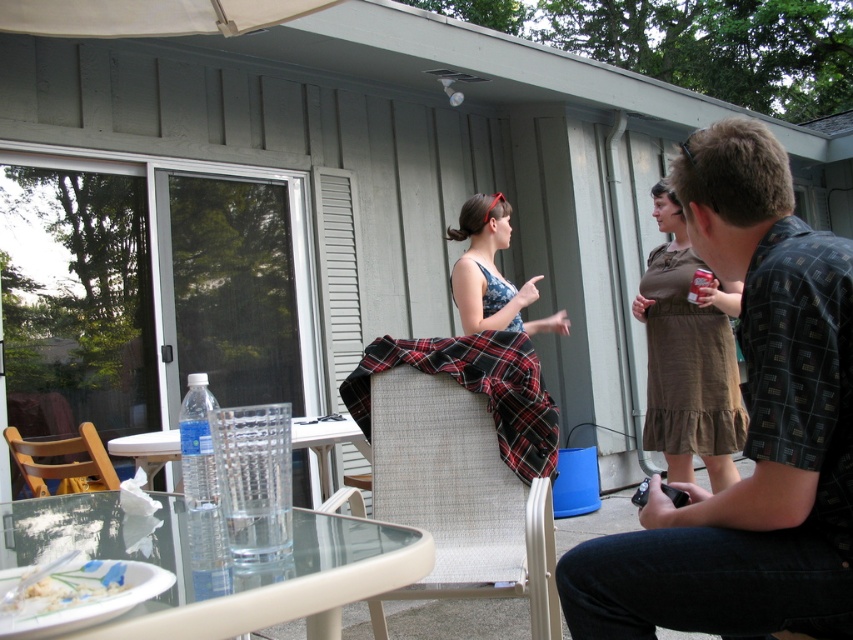
Question: Which point appears closest to the camera in this image?

Choices:
 (A) (518, 422)
 (B) (711, 138)
 (C) (184, 282)
 (D) (146, 458)

Answer: (B)

Question: Among these points, which one is farthest from the camera?

Choices:
 (A) (675, 220)
 (B) (152, 476)
 (C) (469, 376)
 (D) (335, 538)

Answer: (A)

Question: Can you confirm if plaid fabric chair at center is smaller than brown cotton dress at center?

Choices:
 (A) yes
 (B) no

Answer: (A)

Question: Does transparent plastic screen door at center have a larger size compared to matte floral dress at center?

Choices:
 (A) yes
 (B) no

Answer: (A)

Question: Among these points, which one is nearest to the camera?

Choices:
 (A) (776, 198)
 (B) (432, 532)

Answer: (A)

Question: Can you confirm if transparent glass table at lower center is wider than plaid fabric blanket at center?

Choices:
 (A) yes
 (B) no

Answer: (A)